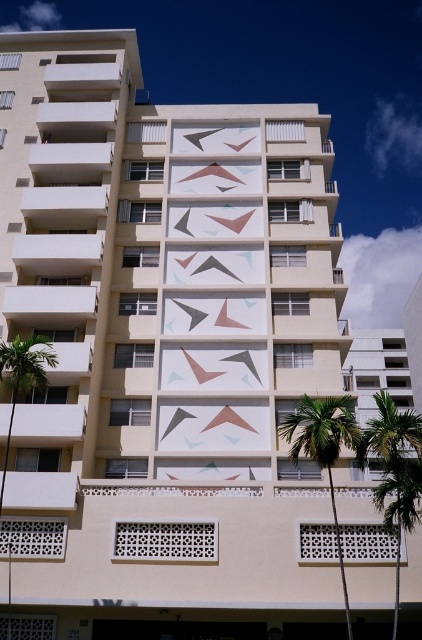
Is point (402, 416) positioned after point (299, 444)?

Yes.

Which is in front, point (397, 604) or point (319, 456)?

Point (397, 604) is in front.

This screenshot has width=422, height=640. I want to click on green leafy palm tree at right, so click(394, 472).

Locate an element on the screen. The image size is (422, 640). green leafy palm tree at lower right is located at coordinates (324, 449).

Can you confirm if green leafy palm tree at lower right is shorter than green leafy palm tree at left?

In fact, green leafy palm tree at lower right may be taller than green leafy palm tree at left.

Is point (302, 449) positioned after point (45, 353)?

Yes.

The width and height of the screenshot is (422, 640). What are the coordinates of `green leafy palm tree at lower right` in the screenshot? It's located at (324, 449).

Who is higher up, green leafy palm tree at right or green leafy palm tree at left?

green leafy palm tree at left

Does point (378, 420) come closer to viewer compared to point (40, 353)?

Yes, it is in front of point (40, 353).

Locate an element on the screen. This screenshot has height=640, width=422. green leafy palm tree at right is located at coordinates (394, 472).